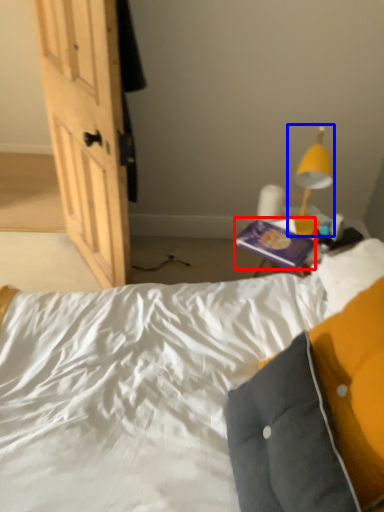
Question: Which object appears farthest to the camera in this image, paperback book (highlighted by a red box) or lamp (highlighted by a blue box)?

Choices:
 (A) paperback book
 (B) lamp

Answer: (A)